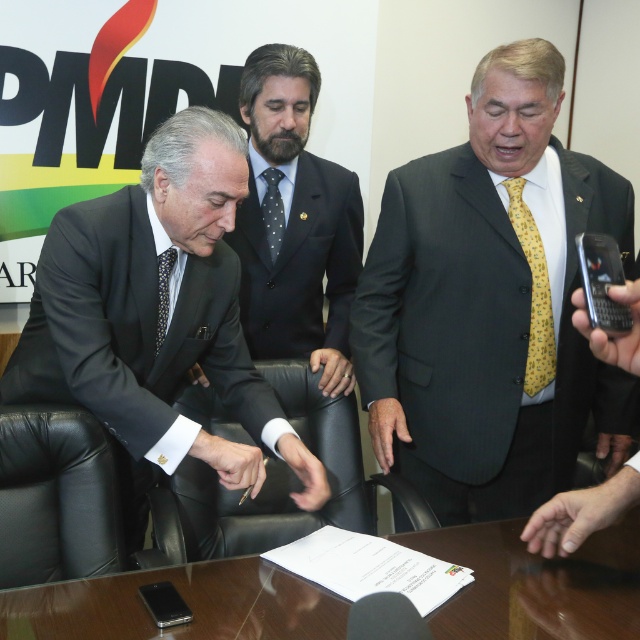
Question: Is matte black suit at left bigger than dark blue suit at center?

Choices:
 (A) yes
 (B) no

Answer: (A)

Question: Is yellow textured tie at center positioned behind dark blue suit at center?

Choices:
 (A) yes
 (B) no

Answer: (B)

Question: Which of the following is the farthest from the observer?

Choices:
 (A) (164, 332)
 (B) (81, 586)
 (C) (262, 220)
 (D) (509, 220)

Answer: (C)

Question: Which of the following is the closest to the observer?

Choices:
 (A) (220, 342)
 (B) (522, 324)
 (C) (157, 314)

Answer: (C)

Question: Estimate the real-world distances between objects in this image. Which object is closer to the dotted fabric tie at center?

Choices:
 (A) yellow printed tie at center
 (B) dark blue suit at center
 (C) yellow textured tie at center
 (D) glossy wooden table at center

Answer: (B)

Question: Is matte black suit at left to the right of dotted fabric tie at center from the viewer's perspective?

Choices:
 (A) no
 (B) yes

Answer: (A)